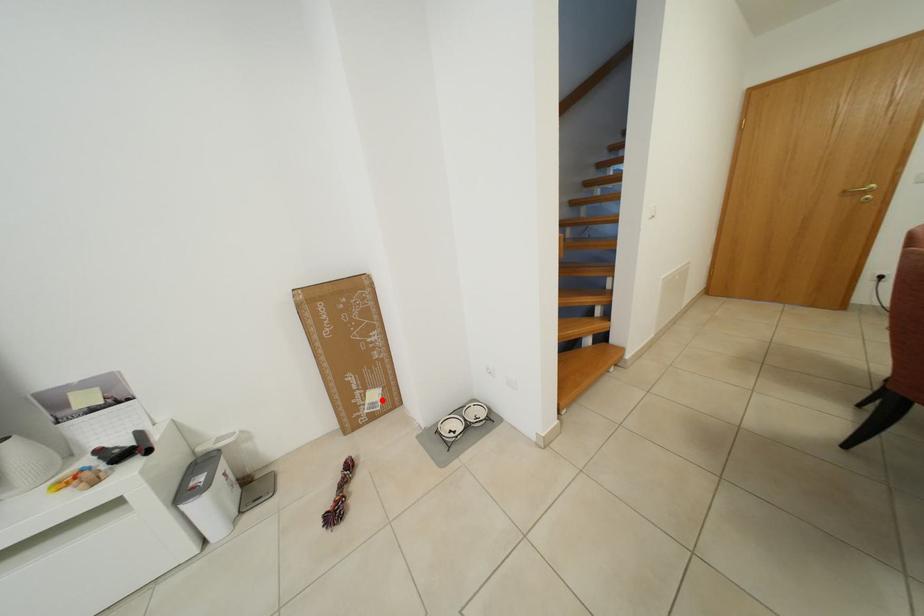
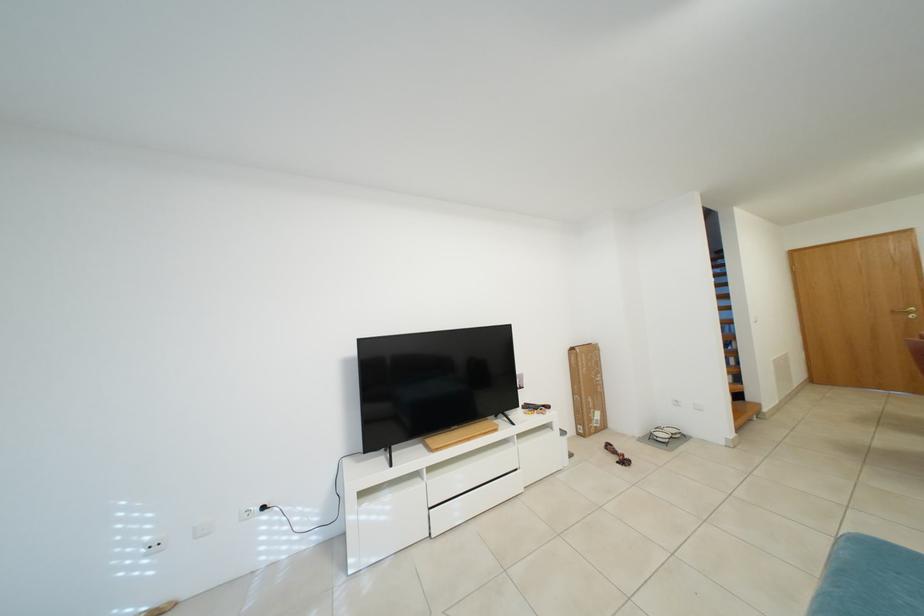
Question: I am providing you with two images of the same scene from different viewpoints. Given a red point in image1, look at the same physical point in image2. Is it:

Choices:
 (A) Closer to the viewpoint
 (B) Farther from the viewpoint

Answer: (B)